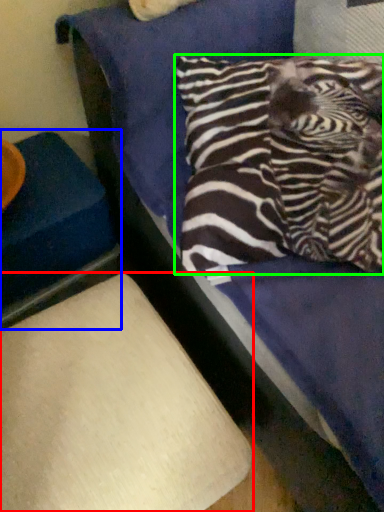
Question: Estimate the real-world distances between objects in this image. Which object is farther from furniture (highlighted by a red box), furniture (highlighted by a blue box) or pillow (highlighted by a green box)?

Choices:
 (A) furniture
 (B) pillow

Answer: (B)